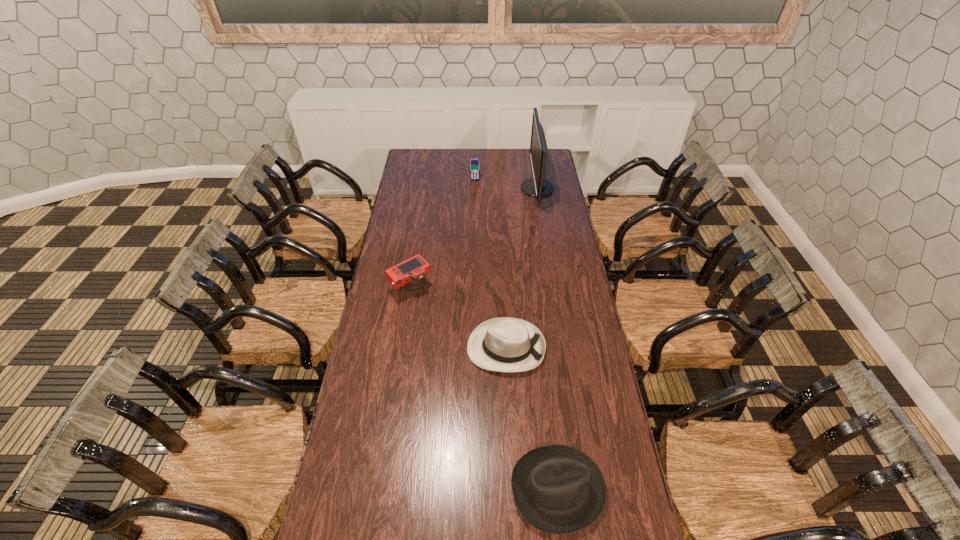
Find the location of a particular element. vacant space at the far edge of the desktop is located at coordinates coord(483,160).

The width and height of the screenshot is (960, 540). Find the location of `vacant space at the left edge of the desktop`. vacant space at the left edge of the desktop is located at coordinates 347,431.

The width and height of the screenshot is (960, 540). I want to click on vacant space at the right edge of the desktop, so click(566, 301).

Locate an element on the screen. The image size is (960, 540). vacant space at the far left corner is located at coordinates click(x=411, y=159).

This screenshot has height=540, width=960. In the image, there is a desktop. Find the location of `free region at the far right corner`. free region at the far right corner is located at coordinates (549, 159).

This screenshot has width=960, height=540. Find the location of `vacant area that lies between the third farthest object and the second nearest object`. vacant area that lies between the third farthest object and the second nearest object is located at coordinates (459, 318).

Where is `blank region between the camera and the fourth farthest object`? The width and height of the screenshot is (960, 540). blank region between the camera and the fourth farthest object is located at coordinates (459, 318).

Where is `free spot between the second nearest object and the nearer fedora`? free spot between the second nearest object and the nearer fedora is located at coordinates (532, 418).

You are a GUI agent. You are given a task and a screenshot of the screen. Output one action in this format:
    pyautogui.click(x=<x>, y=<y>)
    Task: Click on the vacant space in between the second nearest object and the nearest object
    The width and height of the screenshot is (960, 540).
    Given the screenshot: What is the action you would take?
    pyautogui.click(x=532, y=418)

You are a GUI agent. You are given a task and a screenshot of the screen. Output one action in this format:
    pyautogui.click(x=<x>, y=<y>)
    Task: Click on the free space that is in between the cellular telephone and the monitor
    The image size is (960, 540).
    Given the screenshot: What is the action you would take?
    pyautogui.click(x=506, y=184)